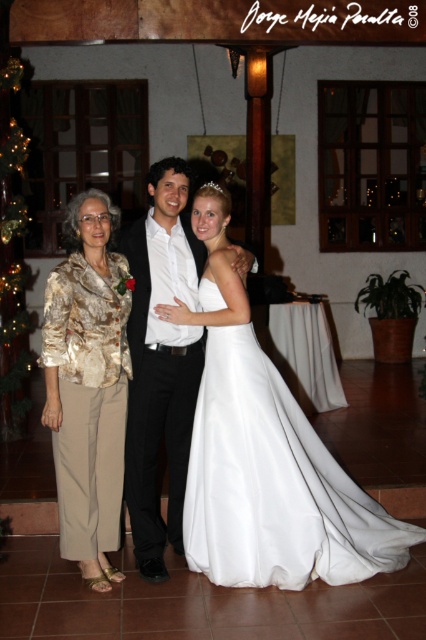
Is white satin dress at center thinner than gold textured blouse at left?

No, white satin dress at center is not thinner than gold textured blouse at left.

Does white satin dress at center have a lesser height compared to gold textured blouse at left?

Yes.

Where is `white satin dress at center`? Image resolution: width=426 pixels, height=640 pixels. white satin dress at center is located at coordinates (273, 484).

Can you confirm if white satin dress at center is shorter than shiny black suit at center?

Yes, white satin dress at center is shorter than shiny black suit at center.

Between point (224, 508) and point (152, 531), which one is positioned in front?

Point (224, 508) is more forward.

Looking at this image, measure the distance between point [239,467] and camera.

Point [239,467] is 3.59 meters away from camera.

You are a GUI agent. You are given a task and a screenshot of the screen. Output one action in this format:
    pyautogui.click(x=<x>, y=<y>)
    Task: Click on the white satin dress at center
    Image resolution: width=426 pixels, height=640 pixels.
    Given the screenshot: What is the action you would take?
    pyautogui.click(x=273, y=484)

Can you confirm if gold textured blouse at left is shorter than shiny black suit at center?

Correct, gold textured blouse at left is not as tall as shiny black suit at center.

Between gold textured blouse at left and shiny black suit at center, which one is positioned higher?

Positioned higher is shiny black suit at center.

Image resolution: width=426 pixels, height=640 pixels. What are the coordinates of `gold textured blouse at left` in the screenshot? It's located at (88, 385).

Identify the location of gold textured blouse at left. Image resolution: width=426 pixels, height=640 pixels. (88, 385).